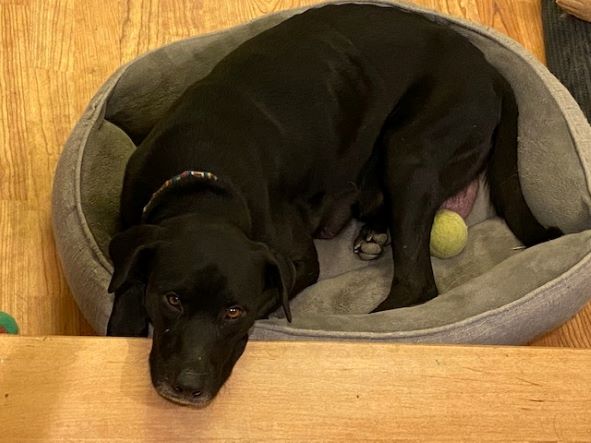
Identify the location of pillow. The width and height of the screenshot is (591, 443). (569, 44).